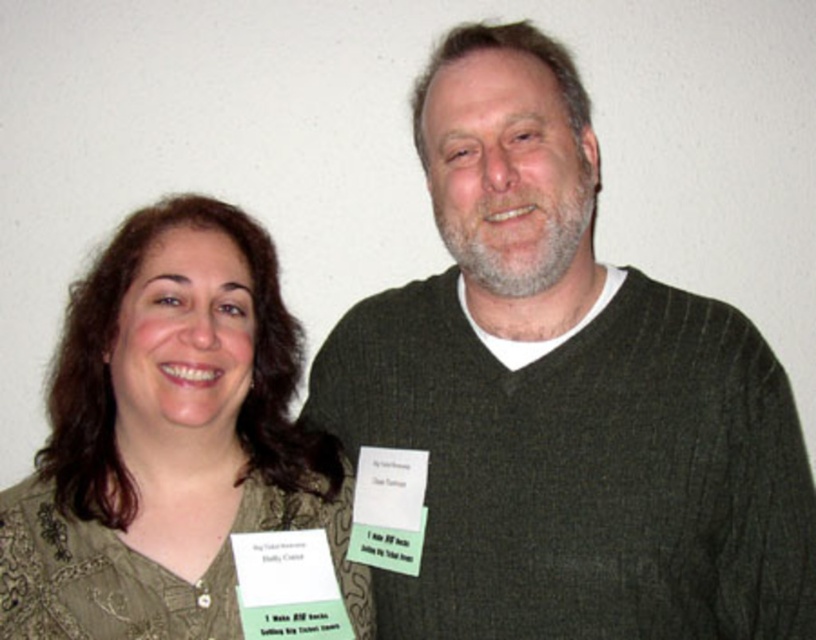
You are a photographer trying to capture both the dark green sweater at center and the green textured blouse at center in a single frame. Based on their widths, which one should you position closer to the center of the frame to ensure both are fully visible?

The dark green sweater at center is wider than the green textured blouse at center. To ensure both are fully visible in the frame, position the dark green sweater at center closer to the center of the frame so it takes up more space while still allowing the green textured blouse at center to be captured.

Looking at this image, you are a photographer setting up a shoot for two models wearing the dark green sweater at center and the green textured blouse at center. You want to ensure they are positioned so that the sweater is clearly visible. Based on their current positions, which model should move to the left to achieve this?

The model wearing the dark green sweater at center should move to the left since it is currently positioned to the right of the green textured blouse at center. Moving left would create more space between them, ensuring the sweater is clearly visible.